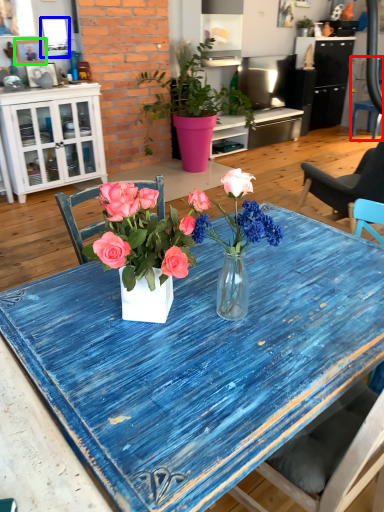
Question: Based on their relative distances, which object is farther from chair (highlighted by a red box)? Choose from picture frame (highlighted by a blue box) and picture frame (highlighted by a green box).

Choices:
 (A) picture frame
 (B) picture frame

Answer: (B)